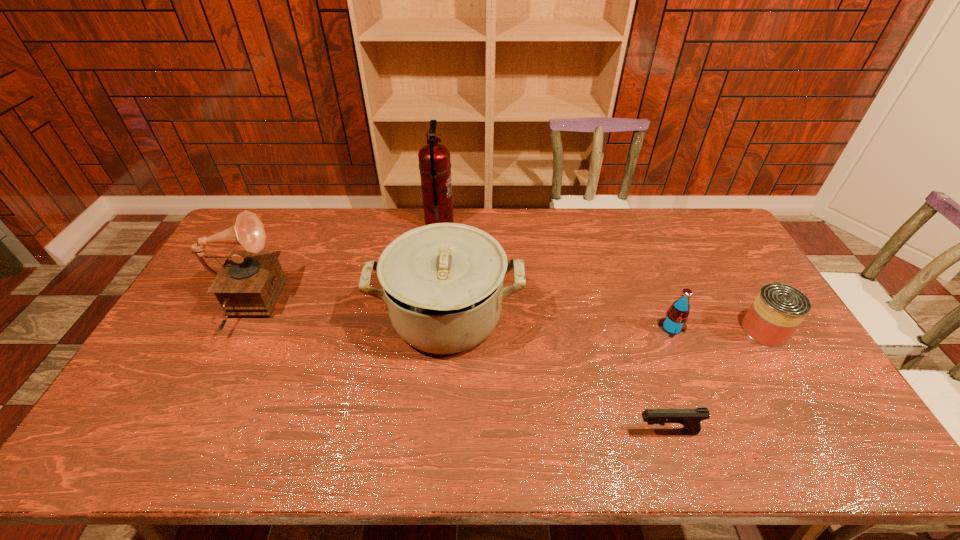
Find the location of a particular element. This screenshot has width=960, height=540. fire extinguisher is located at coordinates click(x=434, y=159).

Find the location of a particular element. The image size is (960, 540). the farthest object is located at coordinates (434, 159).

In order to click on the fifth shortest object in this screenshot , I will do `click(249, 283)`.

The width and height of the screenshot is (960, 540). What are the coordinates of `record player` in the screenshot? It's located at (249, 283).

Locate an element on the screen. This screenshot has height=540, width=960. saucepan is located at coordinates (443, 284).

Locate an element on the screen. soda is located at coordinates (675, 321).

The width and height of the screenshot is (960, 540). I want to click on can, so click(x=778, y=309).

What are the coordinates of `the shortest object` in the screenshot? It's located at (690, 418).

Identify the location of pistol. The width and height of the screenshot is (960, 540). (690, 418).

At what (x,y) coordinates should I click in order to perform the action: click on vacant space located 0.190m on the nozzle side of the farthest object. Please return your answer as a coordinate pair (x, y). This screenshot has width=960, height=540. Looking at the image, I should click on (504, 225).